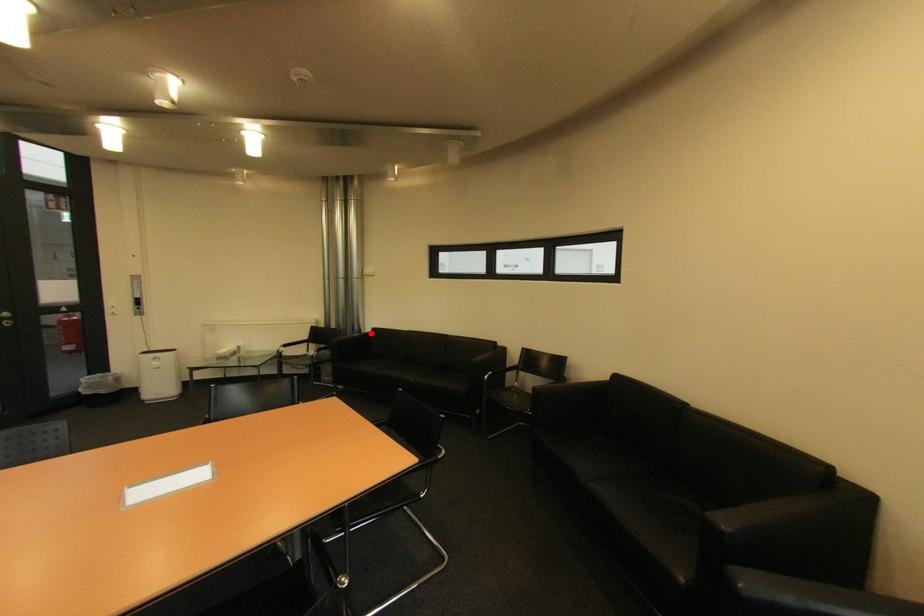
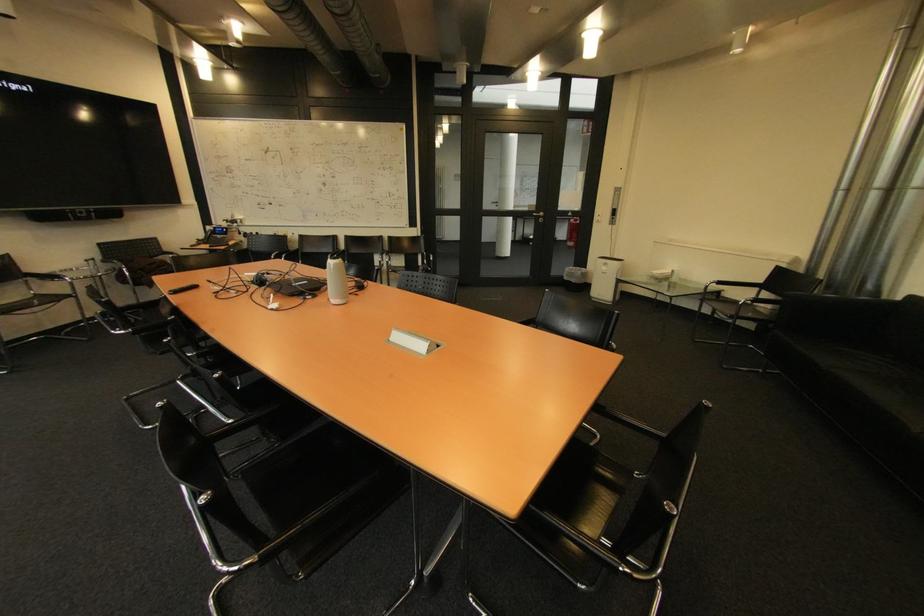
The point at the highlighted location is marked in the first image. Where is the corresponding point in the second image?

(893, 300)